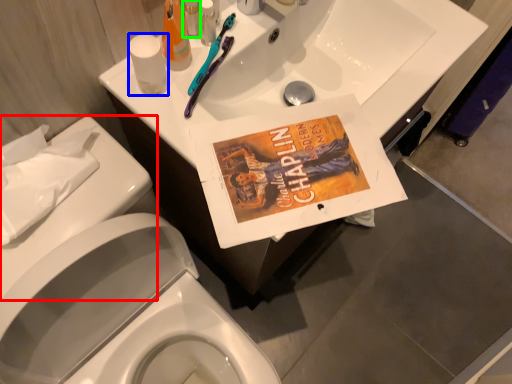
Question: Estimate the real-world distances between objects in this image. Which object is farther from porcelain (highlighted by a red box), toilet paper (highlighted by a blue box) or toiletry (highlighted by a green box)?

Choices:
 (A) toilet paper
 (B) toiletry

Answer: (B)